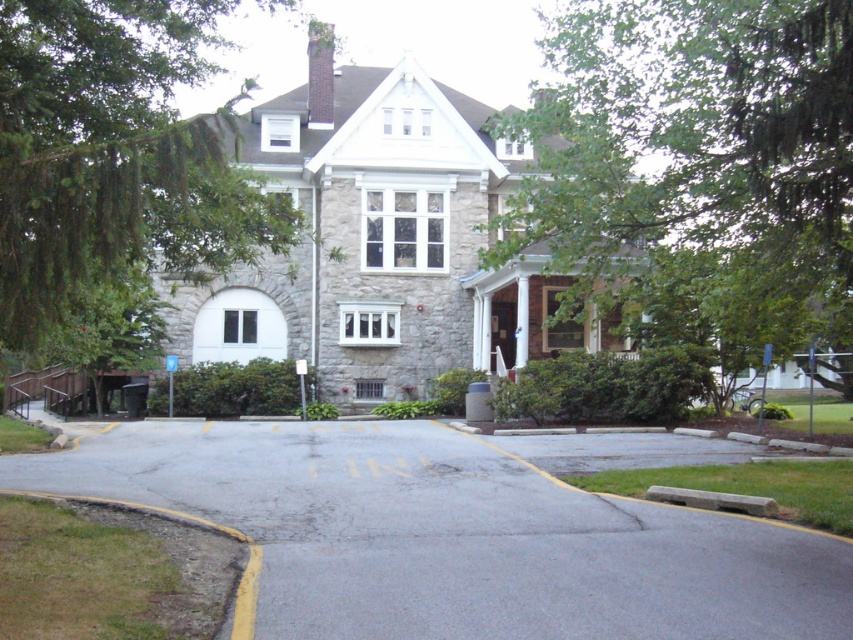
Question: Is gray asphalt driveway at center below green leafy tree at center?

Choices:
 (A) yes
 (B) no

Answer: (A)

Question: Which object is closer to the camera taking this photo?

Choices:
 (A) green leafy tree at center
 (B) gray asphalt driveway at center

Answer: (B)

Question: Is the position of gray asphalt driveway at center more distant than that of green leafy tree at left?

Choices:
 (A) no
 (B) yes

Answer: (B)

Question: Which point is farther to the camera?

Choices:
 (A) (668, 634)
 (B) (793, 195)
 (C) (126, 44)

Answer: (B)

Question: Among these objects, which one is farthest from the camera?

Choices:
 (A) green leafy tree at center
 (B) green leafy tree at left

Answer: (A)

Question: Is gray asphalt driveway at center closer to the viewer compared to green leafy tree at left?

Choices:
 (A) yes
 (B) no

Answer: (B)